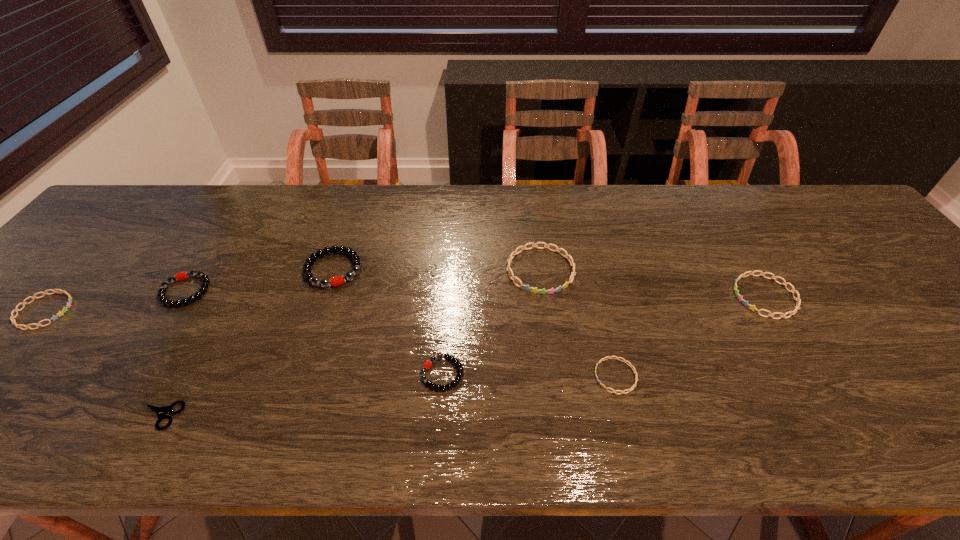
You are a GUI agent. You are given a task and a screenshot of the screen. Output one action in this format:
    pyautogui.click(x=<x>, y=<y>)
    Task: Click on the free spot between the biggest blue bracelet and the rightmost blue bracelet
    This screenshot has width=960, height=540.
    Given the screenshot: What is the action you would take?
    pyautogui.click(x=653, y=284)

Find the location of a particular element. blank region between the smallest black bracelet and the second biggest black bracelet is located at coordinates (314, 333).

The image size is (960, 540). In order to click on empty space between the second bracelet from left to right and the second smallest blue bracelet in this screenshot , I will do `click(115, 301)`.

Identify the location of vacant space in between the smallest black bracelet and the second biggest black bracelet. (314, 333).

Identify which object is the third nearest to the biggest blue bracelet. Please provide its 2D coordinates. Your answer should be formatted as a tuple, i.e. [(x, y)], where the tuple contains the x and y coordinates of a point satisfying the conditions above.

[(307, 266)]

Find the location of a particular element. object that stands as the fifth closest to the second bracelet from left to right is located at coordinates click(526, 287).

Choose which bracelet is the second nearest neighbor to the fourth bracelet from right to left. Please provide its 2D coordinates. Your answer should be formatted as a tuple, i.e. [(x, y)], where the tuple contains the x and y coordinates of a point satisfying the conditions above.

[(307, 266)]

Identify which bracelet is located as the fifth nearest to the fourth bracelet from left to right. Please provide its 2D coordinates. Your answer should be formatted as a tuple, i.e. [(x, y)], where the tuple contains the x and y coordinates of a point satisfying the conditions above.

[(793, 291)]

Locate which blue bracelet ranks in proximity to the rightmost blue bracelet. Please provide its 2D coordinates. Your answer should be formatted as a tuple, i.e. [(x, y)], where the tuple contains the x and y coordinates of a point satisfying the conditions above.

[(608, 357)]

Identify the location of blue bracelet that stands as the closest to the shortest object. Image resolution: width=960 pixels, height=540 pixels. (44, 293).